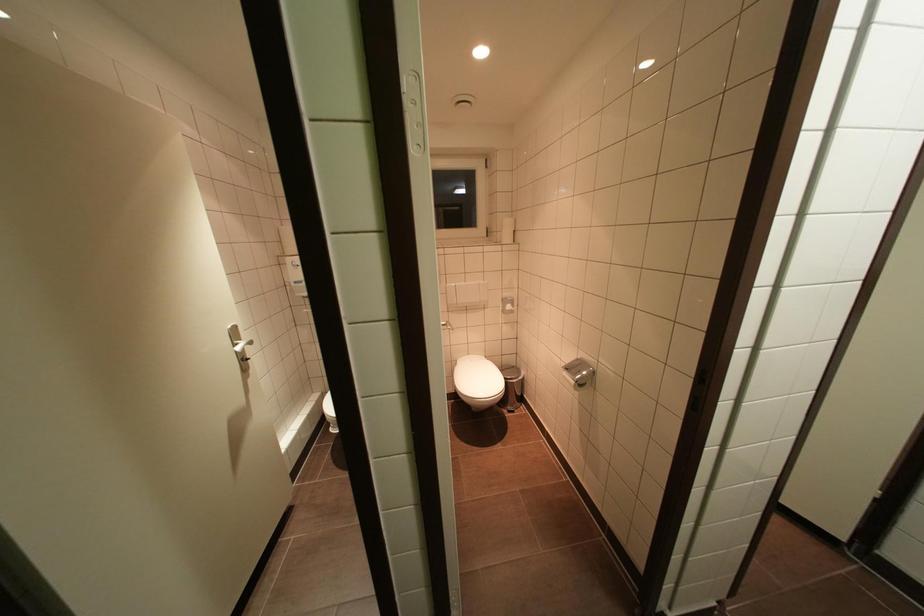
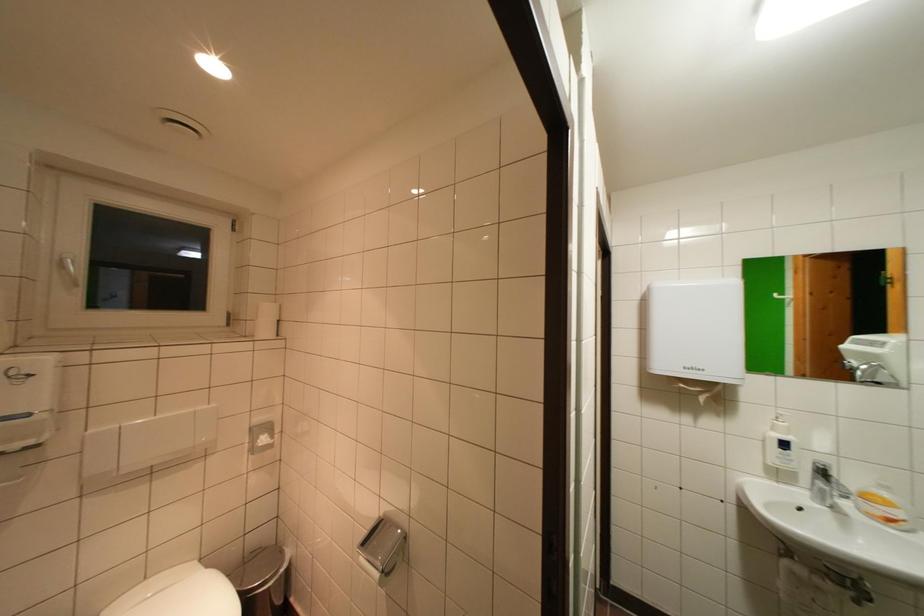
The first image is from the beginning of the video and the second image is from the end. How did the camera likely rotate when shooting the video?

The rotation direction of the camera is right-up.